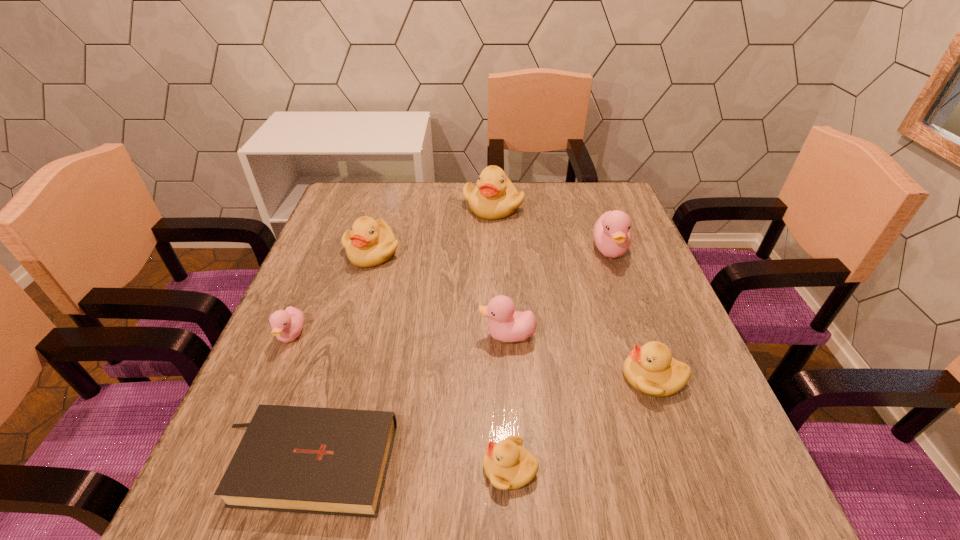
The width and height of the screenshot is (960, 540). I want to click on the leftmost duckling, so click(x=286, y=325).

The image size is (960, 540). I want to click on the shortest duckling, so click(x=508, y=465).

Locate an element on the screen. The width and height of the screenshot is (960, 540). the nearest yellow duckling is located at coordinates (508, 465).

What are the coordinates of `Bible` in the screenshot? It's located at (330, 461).

Locate an element on the screen. The image size is (960, 540). vacant region located at the face of the farthest yellow duckling is located at coordinates (494, 245).

What are the coordinates of `free spot located 0.060m on the front-facing side of the biggest pink duckling` in the screenshot? It's located at (622, 285).

Image resolution: width=960 pixels, height=540 pixels. Identify the location of vacant space located at the face of the second farthest yellow duckling. (325, 408).

At what (x,y) coordinates should I click in order to perform the action: click on vacant space situated 0.110m on the front-facing side of the second biggest pink duckling. Please return your answer as a coordinate pair (x, y). Looking at the image, I should click on (427, 335).

Image resolution: width=960 pixels, height=540 pixels. Identify the location of vacant point located 0.220m on the front-facing side of the second biggest pink duckling. (374, 335).

Image resolution: width=960 pixels, height=540 pixels. Identify the location of free space located on the front-facing side of the second biggest pink duckling. (445, 335).